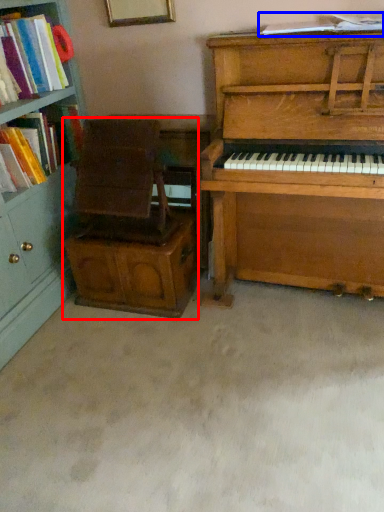
Question: Which point is further to the camera, armchair (highlighted by a red box) or book (highlighted by a blue box)?

Choices:
 (A) armchair
 (B) book

Answer: (A)